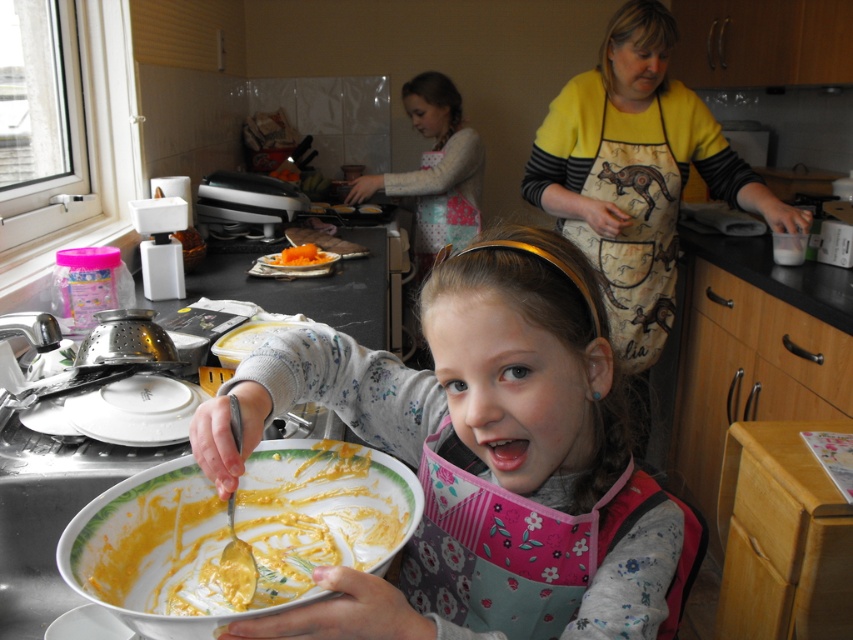
You are a chef preparing a dish and need to place the white matte plate at lower left on the counter next to the yellow printed fabric apron at right. Considering their sizes, will the plate fit next to the apron without overlapping?

The yellow printed fabric apron at right is wider than the white matte plate at lower left. Since the apron is larger, there should be enough space to place the white matte plate at lower left next to it without overlapping, provided the counter has sufficient space.

You are a chef in the kitchen and need to place a garnish on the orange smoothie at center. Where should you place it relative to the orange matte plate at center?

The orange matte plate at center is to the left of the orange smoothie at center, so you should place the garnish to the right of the orange matte plate at center to reach the orange smoothie at center.